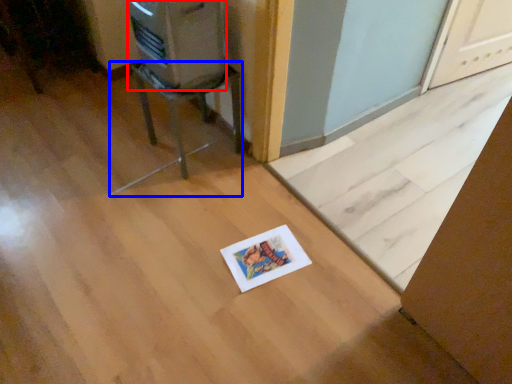
Question: Which object is further to the camera taking this photo, appliance (highlighted by a red box) or furniture (highlighted by a blue box)?

Choices:
 (A) appliance
 (B) furniture

Answer: (B)